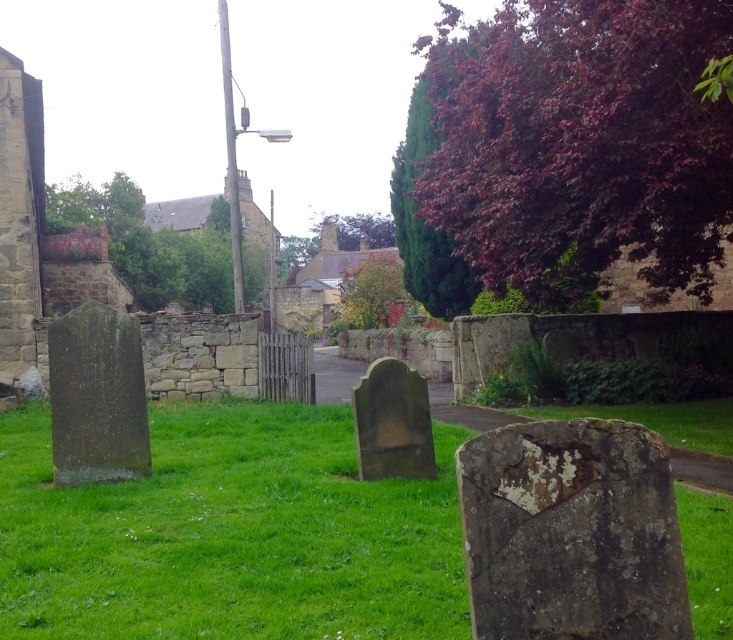
Which is more to the left, green mossy stone at center or granite gravestone at left?

From the viewer's perspective, green mossy stone at center appears more on the left side.

Does green mossy stone at center appear on the right side of granite gravestone at left?

Incorrect, green mossy stone at center is not on the right side of granite gravestone at left.

Who is more distant from viewer, (x=312, y=435) or (x=119, y=426)?

The point (x=312, y=435) is behind.

This screenshot has height=640, width=733. I want to click on green mossy stone at center, so click(229, 532).

Which is in front, point (119, 461) or point (413, 372)?

Point (413, 372) is more forward.

Which is more to the right, granite gravestone at left or smooth gray stone gravestone at center?

Positioned to the right is smooth gray stone gravestone at center.

Identify the location of granite gravestone at left. (95, 396).

Where is `granite gravestone at left`? granite gravestone at left is located at coordinates (95, 396).

At what (x,y) coordinates should I click in order to perform the action: click on green mossy stone at center. Please return your answer as a coordinate pair (x, y). This screenshot has height=640, width=733. Looking at the image, I should click on (229, 532).

The height and width of the screenshot is (640, 733). In order to click on green mossy stone at center in this screenshot , I will do `click(229, 532)`.